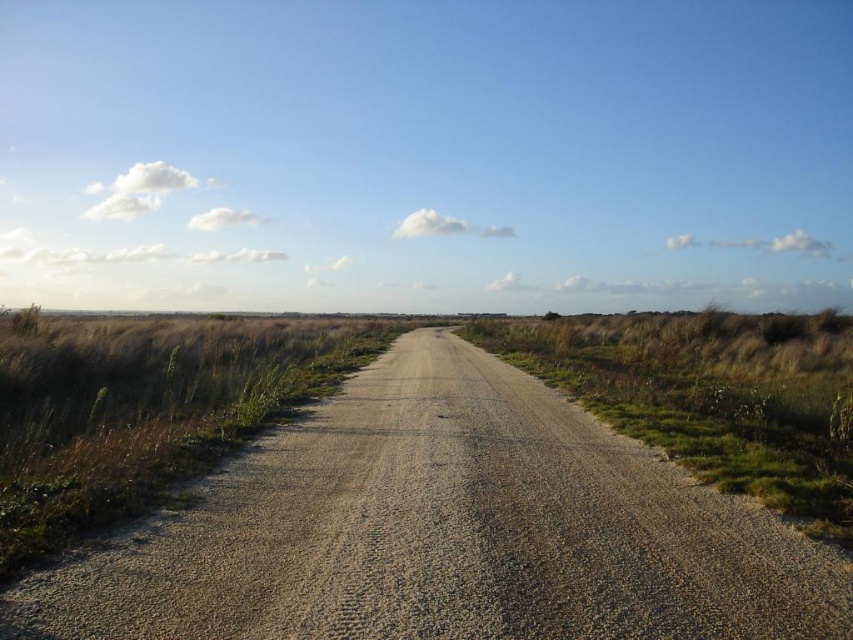
You are a hiker planning to cross the area shown in the image. You need to know which area is smaller in size between the brown gravel road at center and the green grass at right. Which one should you choose if you want to cross the smaller area?

The brown gravel road at center has a smaller size compared to the green grass at right, so you should choose the brown gravel road at center to cross the smaller area.